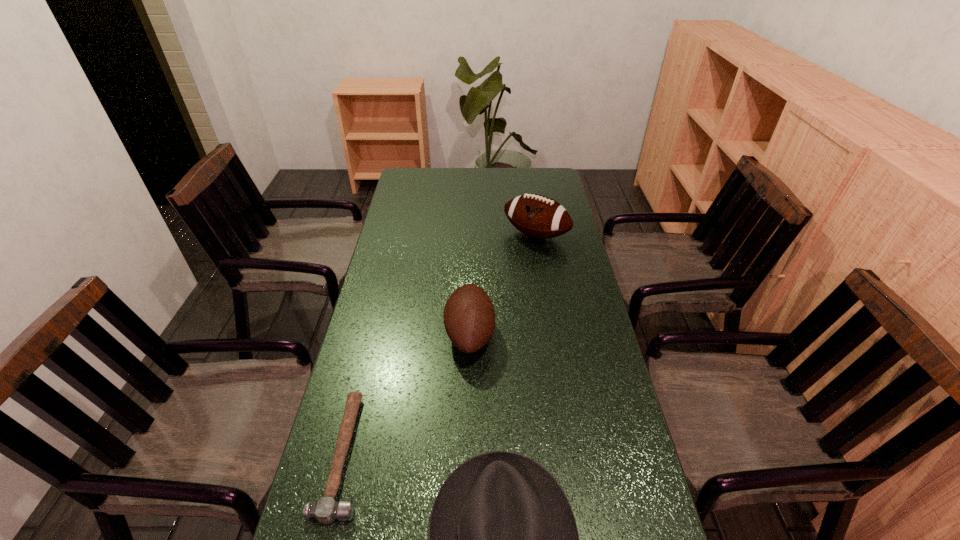
I want to click on the farther football, so tap(538, 216).

Identify the location of the right football. (538, 216).

This screenshot has width=960, height=540. What are the coordinates of `the nearer football` in the screenshot? It's located at (469, 317).

Identify the location of the left football. The height and width of the screenshot is (540, 960). (469, 317).

The image size is (960, 540). What are the coordinates of `the leftmost object` in the screenshot? It's located at (326, 509).

At what (x,y) coordinates should I click in order to perform the action: click on the shortest object. Please return your answer as a coordinate pair (x, y). Image resolution: width=960 pixels, height=540 pixels. Looking at the image, I should click on (326, 509).

Locate an element on the screen. free region located on the back of the farthest object is located at coordinates (529, 192).

Locate an element on the screen. The height and width of the screenshot is (540, 960). blank space located 0.220m on the laces of the second farthest object is located at coordinates (568, 334).

At what (x,y) coordinates should I click in order to perform the action: click on free space located on the striking face of the hammer. Please return your answer as a coordinate pair (x, y). The image size is (960, 540). Looking at the image, I should click on (519, 455).

Find the location of a particular element. This screenshot has height=540, width=960. object positioned at the left edge is located at coordinates (326, 509).